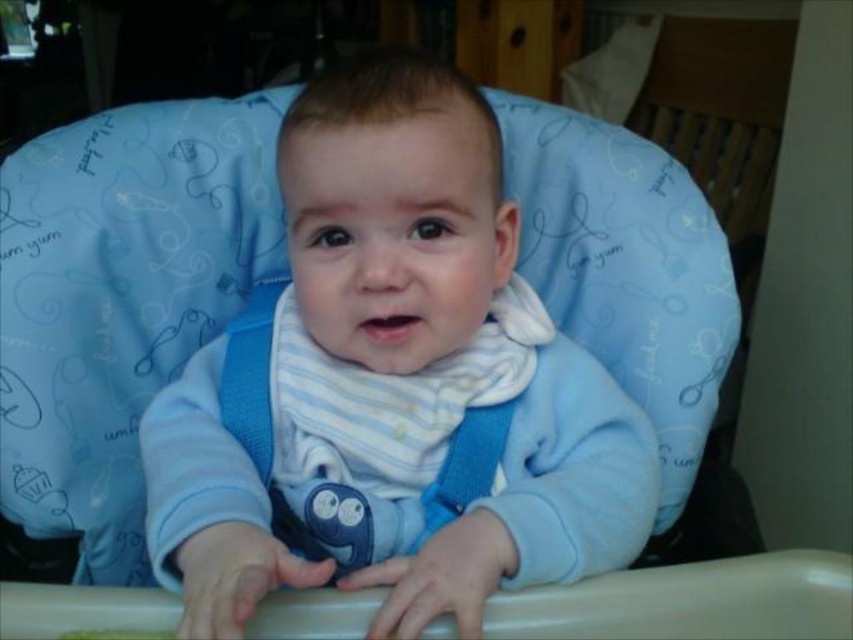
Can you confirm if blue soft bib at center is bigger than white striped bib at center?

Correct, blue soft bib at center is larger in size than white striped bib at center.

Consider the image. Is blue soft bib at center thinner than white striped bib at center?

No, blue soft bib at center is not thinner than white striped bib at center.

What do you see at coordinates (397, 385) in the screenshot? Image resolution: width=853 pixels, height=640 pixels. I see `blue soft bib at center` at bounding box center [397, 385].

This screenshot has height=640, width=853. I want to click on blue soft bib at center, so click(x=397, y=385).